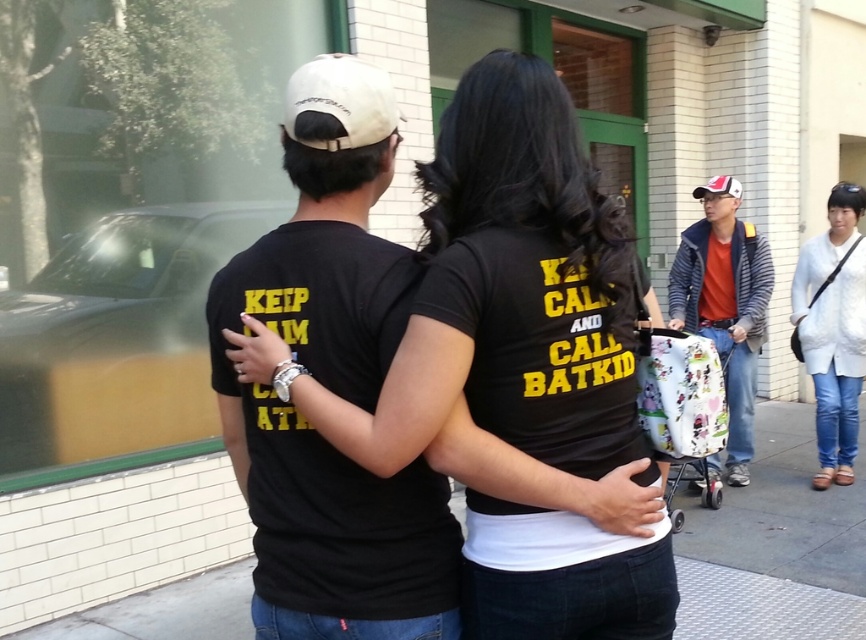
Question: Which is nearer to the gray concrete sidewalk at center?

Choices:
 (A) orange cotton shirt at right
 (B) white cotton shirt at center

Answer: (A)

Question: Which object is positioned closest to the gray concrete sidewalk at center?

Choices:
 (A) black matte t-shirt at center
 (B) orange cotton shirt at right
 (C) black matte shirt at center
 (D) white cotton shirt at center

Answer: (B)

Question: In this image, where is black matte t-shirt at center located relative to orange cotton shirt at right?

Choices:
 (A) above
 (B) below

Answer: (A)

Question: Which point is closer to the camera?

Choices:
 (A) (722, 312)
 (B) (218, 294)
 (C) (111, 612)

Answer: (B)

Question: Does gray concrete sidewalk at center have a greater width compared to white cotton shirt at center?

Choices:
 (A) yes
 (B) no

Answer: (A)

Question: Is black matte shirt at center to the left of orange cotton shirt at right from the viewer's perspective?

Choices:
 (A) no
 (B) yes

Answer: (B)